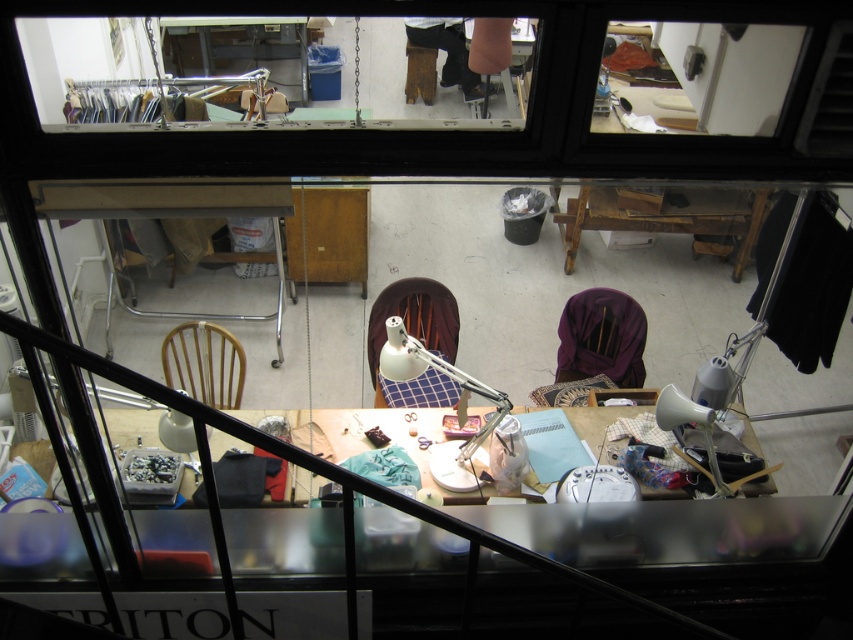
You are organizing the workspace and need to move the dark brown leather pants at upper center. Since the white fabric chair at center is blocking access to it, can you move the chair to the side to reach the pants?

The white fabric chair at center is in front of the dark brown leather pants at upper center, so moving the chair aside would allow access to the pants.